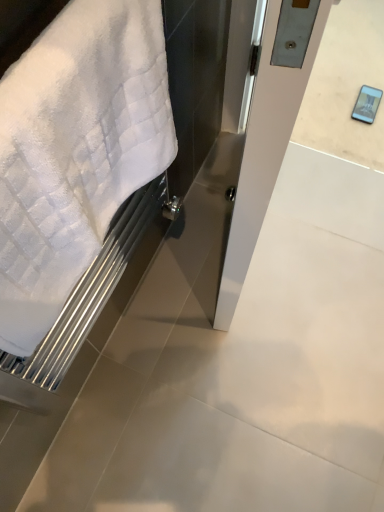
Find the location of `vacant region in front of satin silver door at center`. vacant region in front of satin silver door at center is located at coordinates (238, 364).